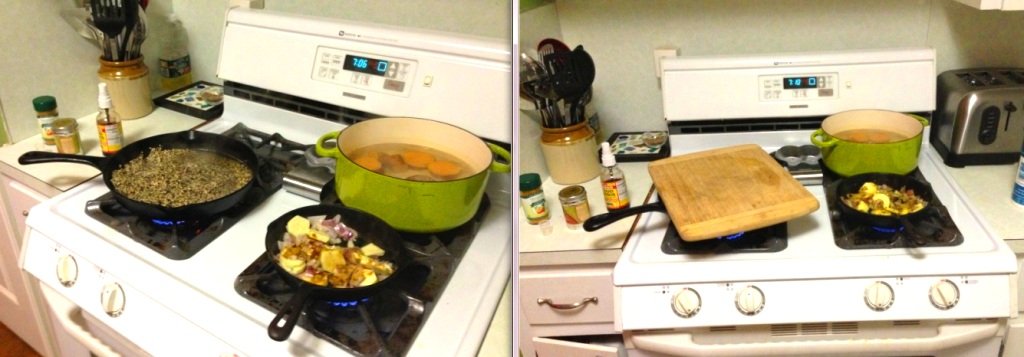
Find the location of `pot`. pot is located at coordinates (414, 192).